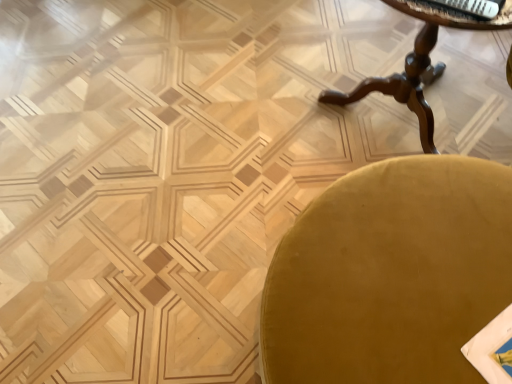
Question: From a real-world perspective, is white glossy magazine at upper right under mahogany wood table at upper right?

Choices:
 (A) no
 (B) yes

Answer: (A)

Question: Is white glossy magazine at upper right positioned beyond the bounds of mahogany wood table at upper right?

Choices:
 (A) yes
 (B) no

Answer: (B)

Question: Does white glossy magazine at upper right have a lesser width compared to mahogany wood table at upper right?

Choices:
 (A) yes
 (B) no

Answer: (A)

Question: Does white glossy magazine at upper right have a greater width compared to mahogany wood table at upper right?

Choices:
 (A) yes
 (B) no

Answer: (B)

Question: Is mahogany wood table at upper right at the back of white glossy magazine at upper right?

Choices:
 (A) yes
 (B) no

Answer: (A)

Question: Is white glossy magazine at upper right touching mahogany wood table at upper right?

Choices:
 (A) no
 (B) yes

Answer: (A)

Question: Is velvet gold chair at lower right to the left of white glossy magazine at upper right from the viewer's perspective?

Choices:
 (A) yes
 (B) no

Answer: (A)

Question: From the image's perspective, is velvet gold chair at lower right located beneath white glossy magazine at upper right?

Choices:
 (A) no
 (B) yes

Answer: (B)

Question: Considering the relative sizes of velvet gold chair at lower right and white glossy magazine at upper right in the image provided, is velvet gold chair at lower right thinner than white glossy magazine at upper right?

Choices:
 (A) yes
 (B) no

Answer: (B)

Question: Is velvet gold chair at lower right shorter than white glossy magazine at upper right?

Choices:
 (A) no
 (B) yes

Answer: (A)

Question: Does velvet gold chair at lower right have a greater width compared to white glossy magazine at upper right?

Choices:
 (A) no
 (B) yes

Answer: (B)

Question: Considering the relative sizes of velvet gold chair at lower right and white glossy magazine at upper right in the image provided, is velvet gold chair at lower right bigger than white glossy magazine at upper right?

Choices:
 (A) yes
 (B) no

Answer: (A)

Question: Is mahogany wood table at upper right to the right of velvet gold chair at lower right from the viewer's perspective?

Choices:
 (A) yes
 (B) no

Answer: (A)